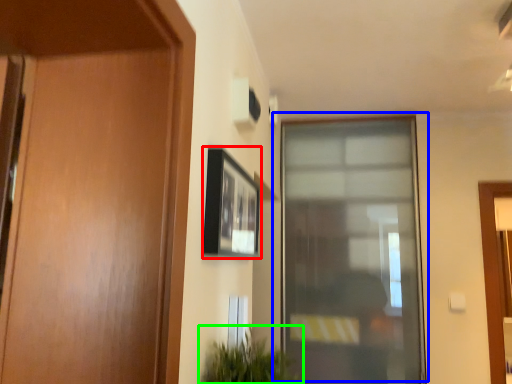
Question: Which is nearer to the picture frame (highlighted by a red box)? window (highlighted by a blue box) or houseplant (highlighted by a green box).

Choices:
 (A) window
 (B) houseplant

Answer: (B)